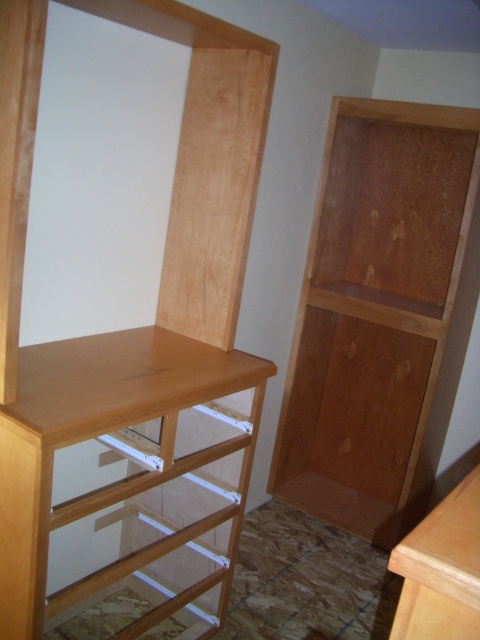
Question: Can you confirm if light brown wood bookshelf at left is smaller than natural wood bookshelf at right?

Choices:
 (A) yes
 (B) no

Answer: (A)

Question: Which point is farther from the camera taking this photo?

Choices:
 (A) click(113, 353)
 (B) click(448, 316)

Answer: (B)

Question: Among these points, which one is nearest to the camera?

Choices:
 (A) (383, 445)
 (B) (41, 554)

Answer: (B)

Question: Is light brown wood bookshelf at left above natural wood bookshelf at right?

Choices:
 (A) yes
 (B) no

Answer: (B)

Question: Does light brown wood bookshelf at left have a greater width compared to natural wood bookshelf at right?

Choices:
 (A) no
 (B) yes

Answer: (A)